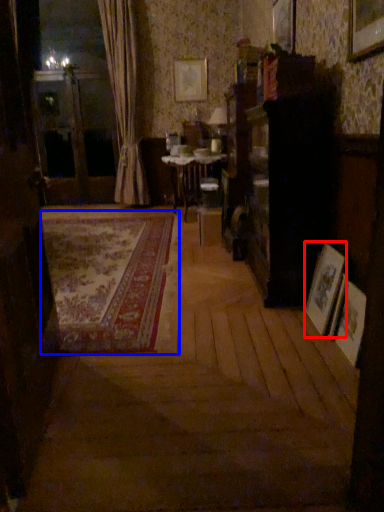
Question: Among these objects, which one is farthest to the camera, picture frame (highlighted by a red box) or plain (highlighted by a blue box)?

Choices:
 (A) picture frame
 (B) plain

Answer: (B)